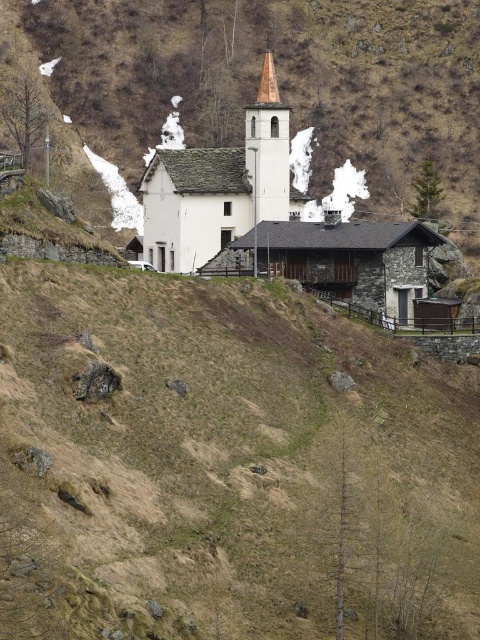
You are standing in the mountainous area and want to take a photo of the white stone church at center and the white matte church at center. Which one will appear larger in your photo?

The white stone church at center will appear larger in the photo because it is closer to the viewer than the white matte church at center.

What is the 2D coordinate of the brown grassy hillside at center?

The brown grassy hillside at center is located at the 2D coordinate point of (227,465).

You are a hiker who wants to take a photo of the brown wood spire at center and the brown grassy hillside at center. Which object should you focus on first if you want to capture both in one frame without moving the camera?

The brown grassy hillside at center is larger in size than the brown wood spire at center, so you should focus on the brown grassy hillside at center first to ensure it fills the frame appropriately before adjusting for the smaller spire.